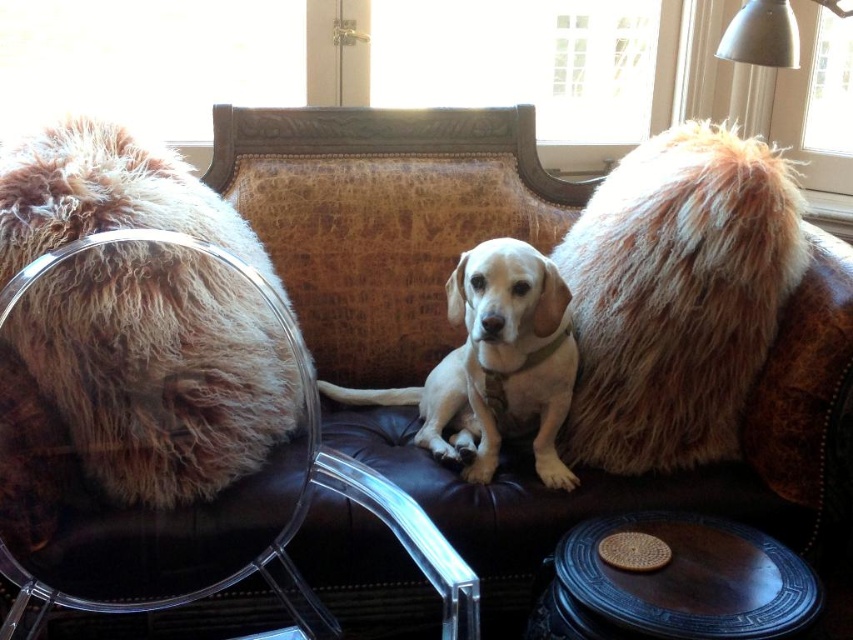
You are a photographer standing in front of the couch. You want to take a closeup photo of the brown textured armchair at center and the fuzzy brown fur at center. Can you fit both of them into your camera frame if your camera has a 1.1 inches wide field of view?

The brown textured armchair at center and fuzzy brown fur at center are 1.13 inches apart. Since the distance between them is greater than the camera frame width of 1.1 inches, you cannot fit both into the frame at the same time.

You are standing in the room and want to place a small table exactly 1.5 meters away from your current position. There is a point marked at coordinates point (107, 211). Can you use this point as the location for the table?

The distance between point (107, 211) and the viewer is 1.34 meters. Since the desired distance is 1.5 meters, the point is slightly closer than required. Therefore, you should move about 0.16 meters further away from the point to reach the desired distance.

You are a photographer standing in front of the couch and want to take a photo of the brown textured armchair at center and the fuzzy brown fur at center. Which object should you focus on first to ensure both are in the frame?

The brown textured armchair at center is closer to the viewer than the fuzzy brown fur at center, so you should focus on the brown textured armchair at center first to ensure both are in the frame.